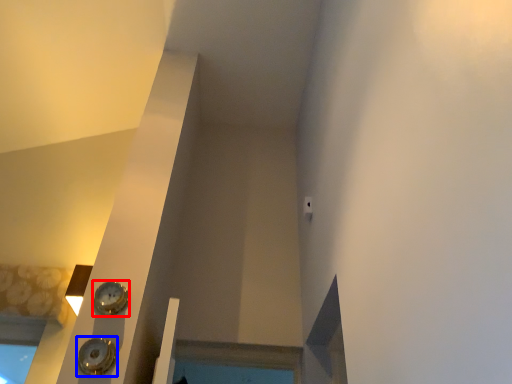
Question: Among these objects, which one is nearest to the camera, clock (highlighted by a red box) or clock (highlighted by a blue box)?

Choices:
 (A) clock
 (B) clock

Answer: (B)